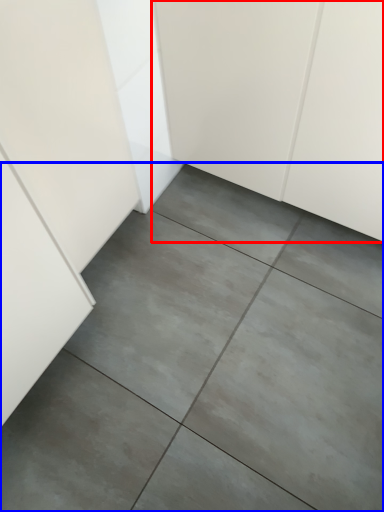
Question: Among these objects, which one is farthest to the camera, cabinetry (highlighted by a red box) or concrete (highlighted by a blue box)?

Choices:
 (A) cabinetry
 (B) concrete

Answer: (B)